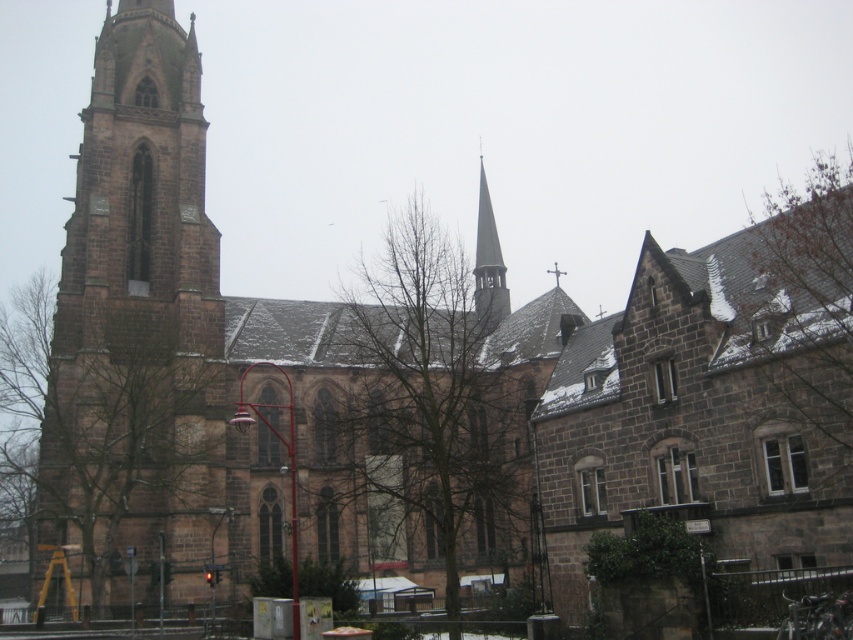
Does point (56, 529) come behind point (495, 243)?

No, (56, 529) is in front of (495, 243).

Describe the element at coordinates (135, 310) in the screenshot. The width and height of the screenshot is (853, 640). I see `brown stone tower at left` at that location.

Which is in front, point (180, 598) or point (500, 272)?

Positioned in front is point (180, 598).

Locate an element on the screen. This screenshot has height=640, width=853. brown stone tower at left is located at coordinates (135, 310).